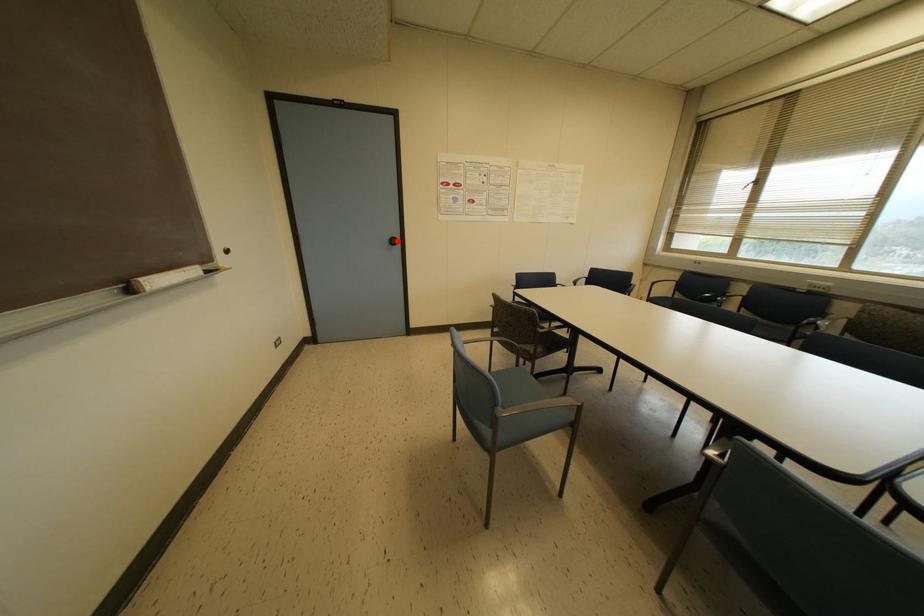
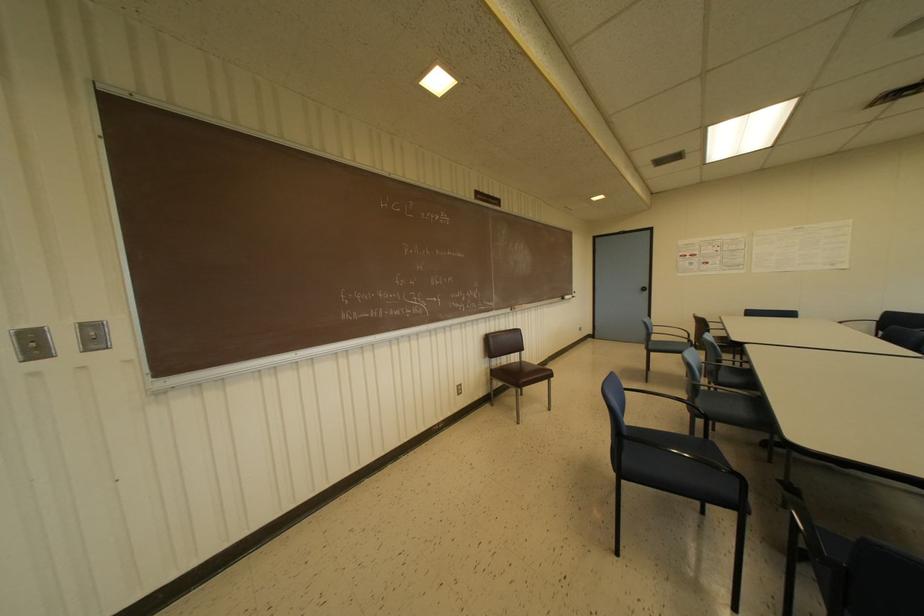
The point at the highlighted location is marked in the first image. Where is the corresponding point in the second image?

(646, 288)